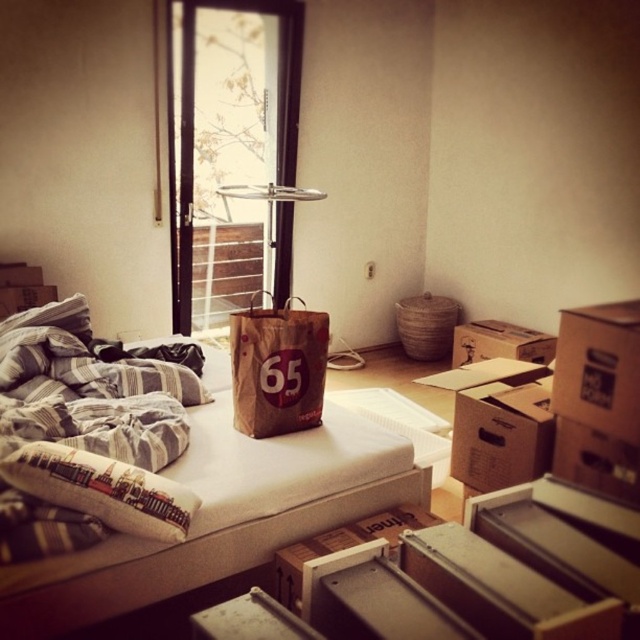
Who is positioned more to the left, white foam mattress at center or printed fabric pillow at center?

printed fabric pillow at center is more to the left.

Does white foam mattress at center appear over printed fabric pillow at center?

No, white foam mattress at center is not above printed fabric pillow at center.

At what (x,y) coordinates should I click in order to perform the action: click on white foam mattress at center. Please return your answer as a coordinate pair (x, y). Looking at the image, I should click on (221, 516).

Is white foam mattress at center bigger than brown paper bag at center?

Yes.

Who is higher up, white foam mattress at center or brown paper bag at center?

brown paper bag at center is higher up.

Is point (346, 426) behind point (284, 307)?

No, (346, 426) is closer to viewer.

At what (x,y) coordinates should I click in order to perform the action: click on white foam mattress at center. Please return your answer as a coordinate pair (x, y). Image resolution: width=640 pixels, height=640 pixels. Looking at the image, I should click on (221, 516).

Can you confirm if printed fabric pillow at center is positioned to the right of brown cardboard box at right?

No, printed fabric pillow at center is not to the right of brown cardboard box at right.

Can you confirm if printed fabric pillow at center is positioned below brown cardboard box at right?

Yes, printed fabric pillow at center is below brown cardboard box at right.

The image size is (640, 640). What do you see at coordinates (102, 490) in the screenshot?
I see `printed fabric pillow at center` at bounding box center [102, 490].

Where is `printed fabric pillow at center`? printed fabric pillow at center is located at coordinates (102, 490).